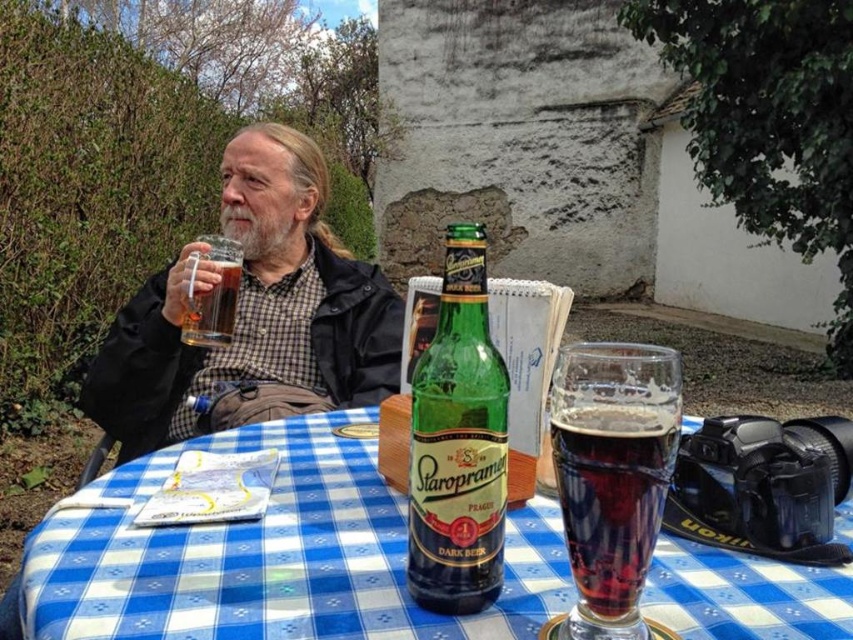
Based on the photo, you are a photographer trying to capture the scene of the man enjoying his drink. You want to ensure that both the blue checkered tablecloth at center and the dark glass beer at center are clearly visible in your shot. Given their sizes, which object should you focus on to ensure it fits entirely within the frame?

The blue checkered tablecloth at center is wider than the dark glass beer at center, so focusing on the tablecloth will ensure it fits entirely within the frame while also capturing the beer.

You are a photographer setting up a shot of the scene. You want to position a small decorative item between the blue checkered tablecloth at center and the green glass bottle at center. Where should you place it to ensure it is centered between them?

The blue checkered tablecloth at center is to the left of the green glass bottle at center, so placing the decorative item halfway between them would mean positioning it between the two objects, closer to the center point between their positions.

You are standing in the outdoor area where the man is sitting. Looking at the blue checkered tablecloth at center and the matte black jacket at upper left, which object is positioned higher from the ground?

The matte black jacket at upper left is positioned higher from the ground than the blue checkered tablecloth at center.